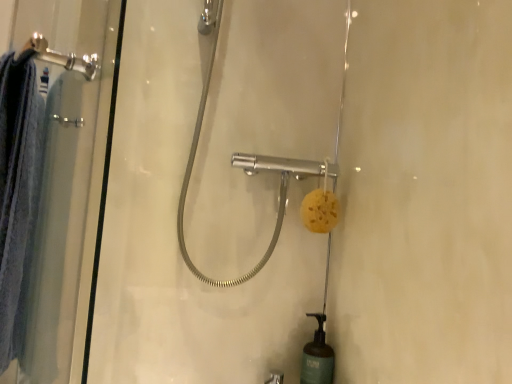
Question: Is clear glass shower door at left facing towards yellow sponge at center?

Choices:
 (A) yes
 (B) no

Answer: (B)

Question: Is clear glass shower door at left completely or partially outside of yellow sponge at center?

Choices:
 (A) no
 (B) yes

Answer: (B)

Question: Can you confirm if clear glass shower door at left is thinner than yellow sponge at center?

Choices:
 (A) yes
 (B) no

Answer: (A)

Question: Considering the relative sizes of clear glass shower door at left and yellow sponge at center in the image provided, is clear glass shower door at left bigger than yellow sponge at center?

Choices:
 (A) no
 (B) yes

Answer: (B)

Question: Is yellow sponge at center at the back of clear glass shower door at left?

Choices:
 (A) yes
 (B) no

Answer: (A)

Question: Considering the relative positions of clear glass shower door at left and yellow sponge at center in the image provided, is clear glass shower door at left behind yellow sponge at center?

Choices:
 (A) no
 (B) yes

Answer: (A)

Question: Is yellow sponge at center outside clear glass shower door at left?

Choices:
 (A) yes
 (B) no

Answer: (A)

Question: From the image's perspective, is yellow sponge at center on clear glass shower door at left?

Choices:
 (A) yes
 (B) no

Answer: (A)

Question: Would you consider yellow sponge at center to be distant from clear glass shower door at left?

Choices:
 (A) no
 (B) yes

Answer: (A)

Question: Is yellow sponge at center behind clear glass shower door at left?

Choices:
 (A) yes
 (B) no

Answer: (A)

Question: Does yellow sponge at center appear on the right side of clear glass shower door at left?

Choices:
 (A) no
 (B) yes

Answer: (B)

Question: From a real-world perspective, is yellow sponge at center on top of clear glass shower door at left?

Choices:
 (A) yes
 (B) no

Answer: (A)

Question: Is yellow sponge at center taller or shorter than clear glass shower door at left?

Choices:
 (A) short
 (B) tall

Answer: (A)